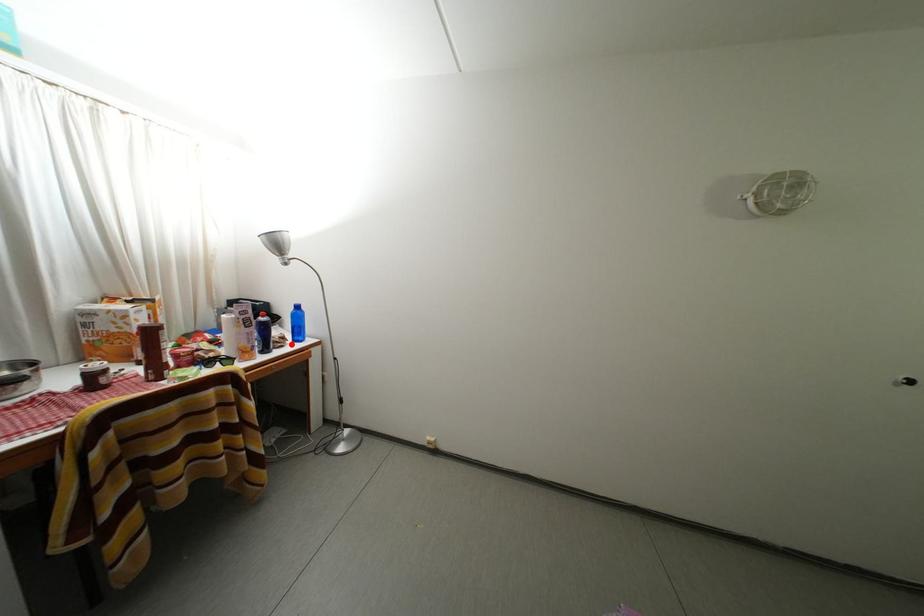
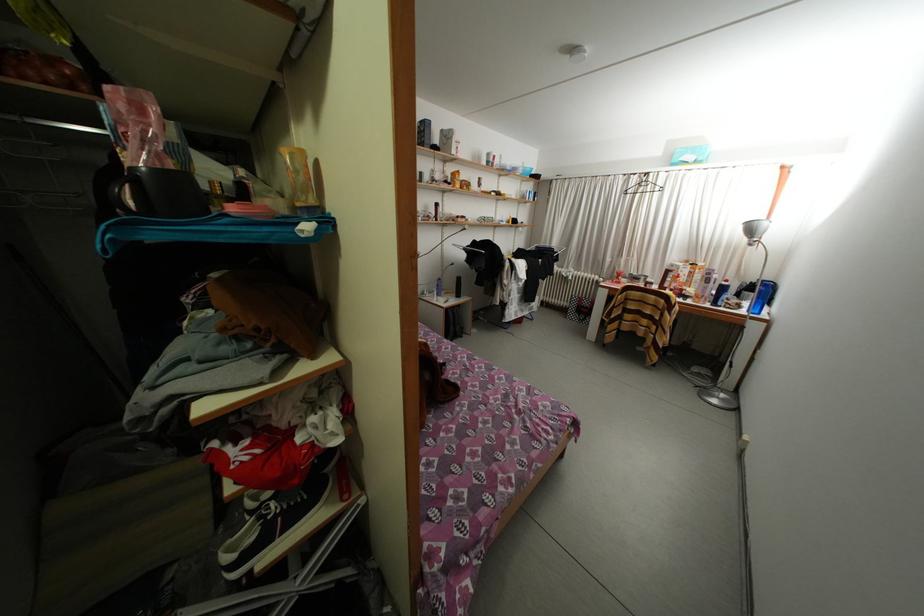
The point at the highlighted location is marked in the first image. Where is the corresponding point in the second image?

(747, 310)